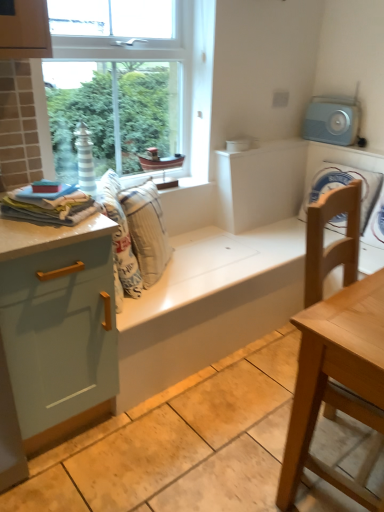
At what (x,y) coordinates should I click in order to perform the action: click on vacant area to the left of light wood table at right. Please return your answer as a coordinate pair (x, y). This screenshot has width=384, height=512. Looking at the image, I should click on (230, 442).